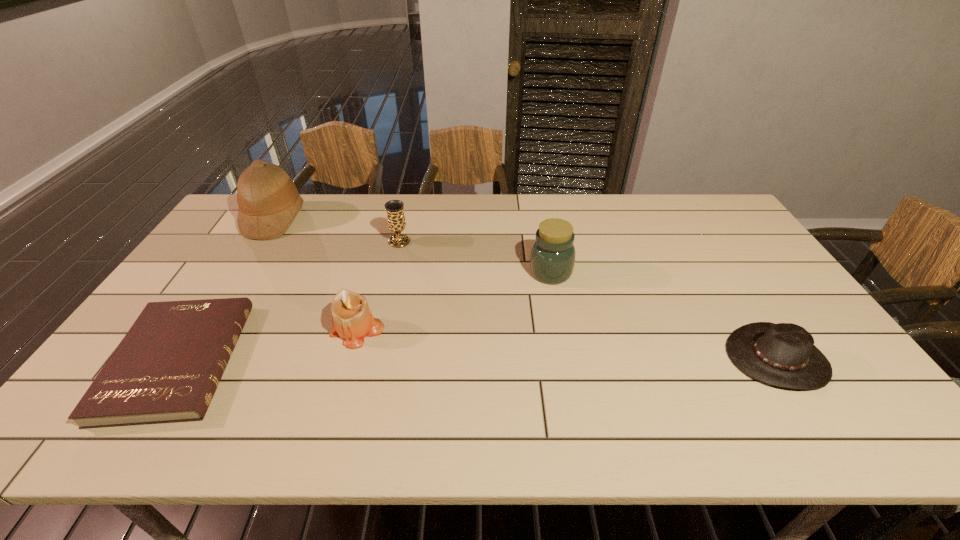
Find the location of a particular element. This screenshot has width=960, height=540. vacant region located 0.070m on the back of the second object from right to left is located at coordinates (545, 246).

You are a GUI agent. You are given a task and a screenshot of the screen. Output one action in this format:
    pyautogui.click(x=<x>, y=<y>)
    Task: Click on the vacant space located 0.330m on the front of the chalice
    The height and width of the screenshot is (540, 960).
    Given the screenshot: What is the action you would take?
    pyautogui.click(x=381, y=321)

I want to click on free space located on the back of the candle, so click(x=381, y=245).

This screenshot has width=960, height=540. I want to click on vacant region located 0.200m on the right of the hardback book, so click(x=317, y=361).

Find the location of a particular element. This screenshot has height=540, width=960. object that is at the far edge is located at coordinates (268, 200).

At what (x,y) coordinates should I click in order to perform the action: click on object that is at the near edge. Please return your answer as a coordinate pair (x, y). Image resolution: width=960 pixels, height=540 pixels. Looking at the image, I should click on (166, 369).

At what (x,y) coordinates should I click in order to perform the action: click on hat situated at the left edge. Please return your answer as a coordinate pair (x, y). This screenshot has height=540, width=960. Looking at the image, I should click on (268, 200).

At what (x,y) coordinates should I click in order to perform the action: click on hardback book present at the left edge. Please return your answer as a coordinate pair (x, y). Looking at the image, I should click on (166, 369).

Where is `object at the right edge`? object at the right edge is located at coordinates (784, 355).

I want to click on object that is at the far left corner, so click(268, 200).